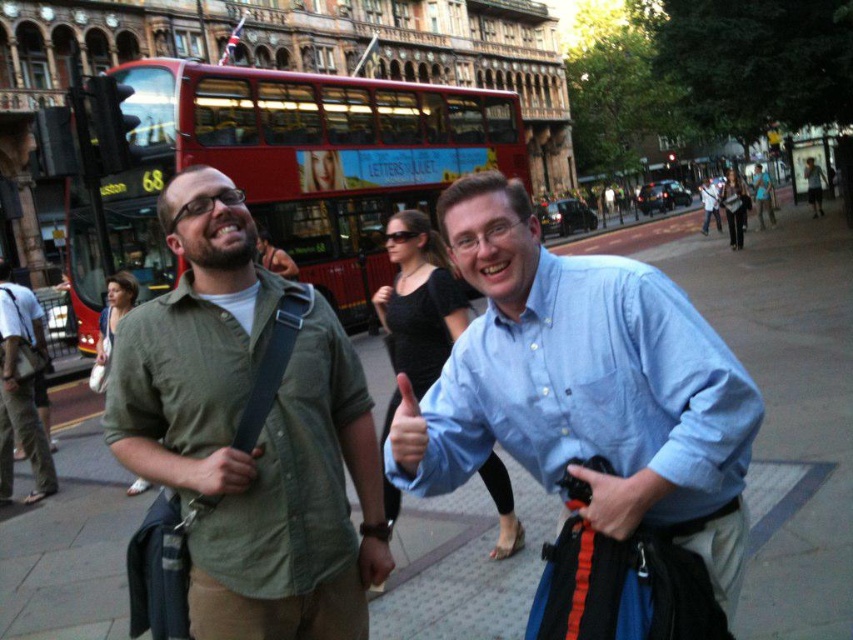
You are a photographer trying to capture a portrait of the two men in the scene. Given the green cotton shirt at center and the matte skin at center, which object would you focus on to ensure the subject is sharp? Explain your reasoning.

The matte skin at center is the actual subject, so focusing on it ensures the person is sharp. The green cotton shirt at center, while part of the subject, is clothing and not the main focus for sharpness.

You are a photographer standing in the middle of the street. You want to take a photo of the green cotton shirt at center. Where should you point your camera to capture it?

You should point your camera towards the coordinates point (x=252, y=433) to capture the green cotton shirt at center.

You are standing in the urban street scene described. You want to take a photo of the light blue cotton shirt at center. Where should you position yourself to capture it in the frame?

To capture the light blue cotton shirt at center, position yourself so the shirt is centered at the coordinates approximately 0.595 on the horizontal axis and 0.691 on the vertical axis within the frame.